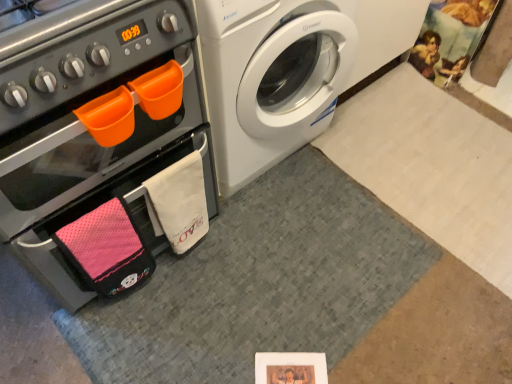
Question: Considering the relative sizes of matte black oven at left and white glossy washing machine at upper right in the image provided, is matte black oven at left wider than white glossy washing machine at upper right?

Choices:
 (A) no
 (B) yes

Answer: (A)

Question: Can you confirm if matte black oven at left is bigger than white glossy washing machine at upper right?

Choices:
 (A) yes
 (B) no

Answer: (A)

Question: Is the depth of matte black oven at left greater than that of white glossy washing machine at upper right?

Choices:
 (A) no
 (B) yes

Answer: (A)

Question: Considering the relative positions of matte black oven at left and white glossy washing machine at upper right in the image provided, is matte black oven at left in front of white glossy washing machine at upper right?

Choices:
 (A) no
 (B) yes

Answer: (B)

Question: From a real-world perspective, is matte black oven at left located higher than white glossy washing machine at upper right?

Choices:
 (A) no
 (B) yes

Answer: (B)

Question: Is matte black oven at left thinner than white glossy washing machine at upper right?

Choices:
 (A) yes
 (B) no

Answer: (A)

Question: Would you say matte black oven at left is part of white glossy washing machine at upper right's contents?

Choices:
 (A) no
 (B) yes

Answer: (A)

Question: Is white glossy washing machine at upper right in contact with matte black oven at left?

Choices:
 (A) no
 (B) yes

Answer: (A)

Question: From a real-world perspective, does white glossy washing machine at upper right stand above matte black oven at left?

Choices:
 (A) yes
 (B) no

Answer: (B)

Question: Considering the relative sizes of white glossy washing machine at upper right and matte black oven at left in the image provided, is white glossy washing machine at upper right bigger than matte black oven at left?

Choices:
 (A) no
 (B) yes

Answer: (A)

Question: Does white glossy washing machine at upper right turn towards matte black oven at left?

Choices:
 (A) yes
 (B) no

Answer: (B)

Question: Considering the relative positions of white glossy washing machine at upper right and matte black oven at left in the image provided, is white glossy washing machine at upper right to the left of matte black oven at left from the viewer's perspective?

Choices:
 (A) no
 (B) yes

Answer: (A)

Question: Based on their positions, is matte black oven at left located to the left or right of white glossy washing machine at upper right?

Choices:
 (A) right
 (B) left

Answer: (B)